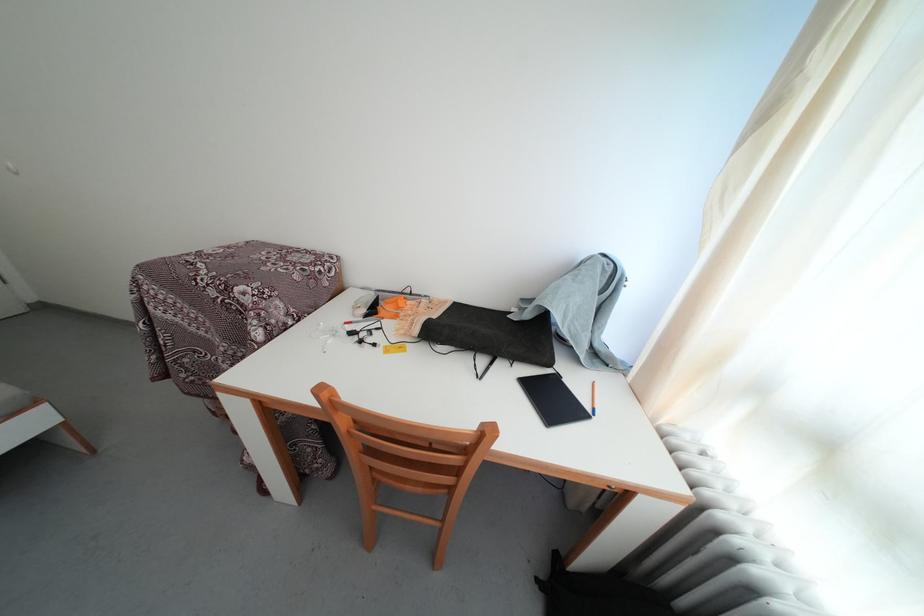
Where would you plugg the white power adapter? Please return your answer as a coordinate pair (x, y).

(363, 304)